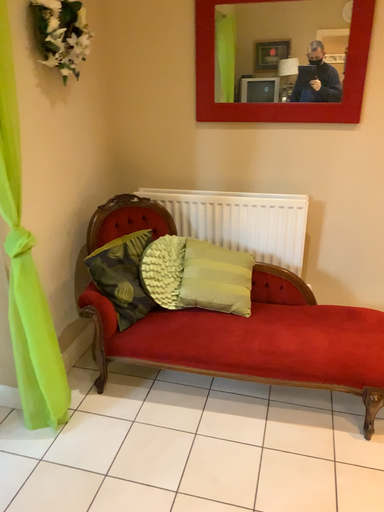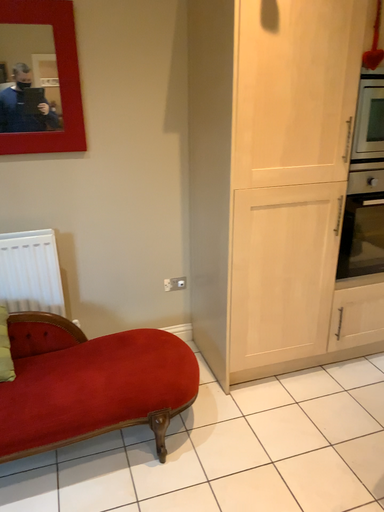
Question: Which way did the camera rotate in the video?

Choices:
 (A) rotated left
 (B) rotated right

Answer: (B)